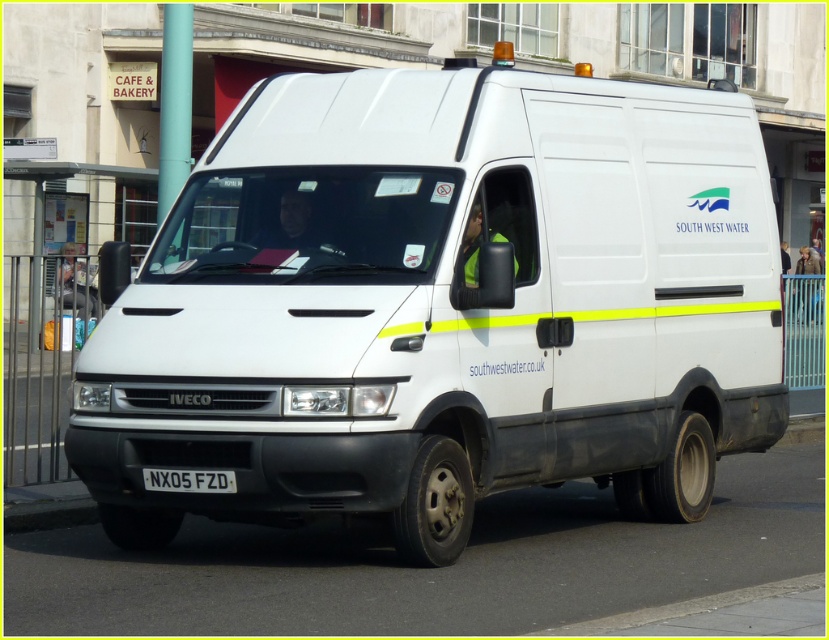
You are a delivery driver who needs to locate the white matte van at center on a map. What are the coordinates where you can find it?

The white matte van at center is located at coordinates point (440, 307).

You are a delivery driver who needs to park your white matte van at center so that its license plate is visible to the traffic camera. The traffic camera is positioned to the left of your current parking spot. Should you move your van to the left or right to ensure the white plastic license plate at center is visible to the camera?

The white matte van at center is positioned on the right side of white plastic license plate at center. To make the white plastic license plate at center visible to the traffic camera on the left, you should move the van to the right so that the license plate becomes more aligned with the camera.

You are a delivery driver who needs to attach a magnetic sign to the white matte van at center. The sign must be placed above the white plastic license plate at center. Given the size difference between the two objects, will the magnetic sign fit comfortably without overlapping the license plate?

The white matte van at center is larger than the white plastic license plate at center, so there is sufficient space to attach the magnetic sign above the license plate without overlapping it.